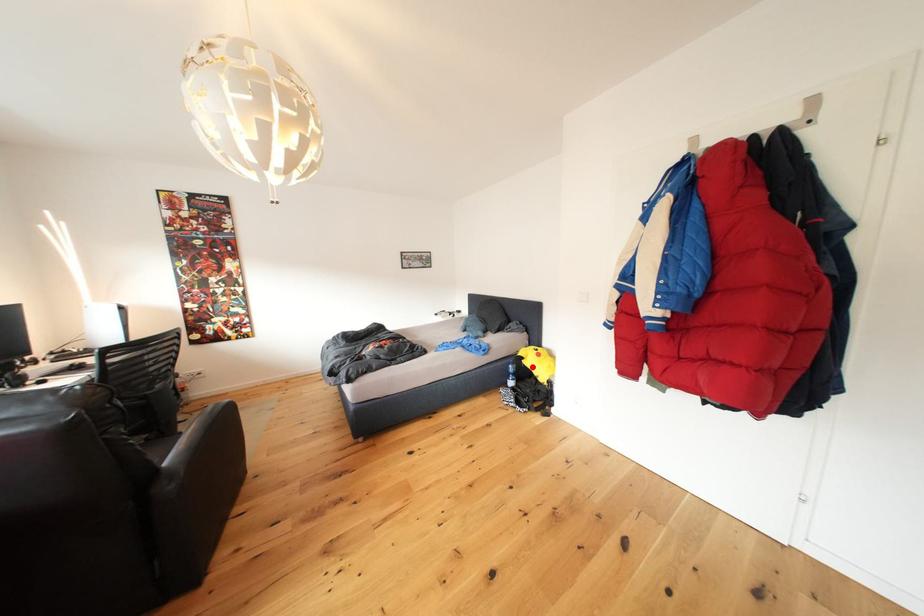
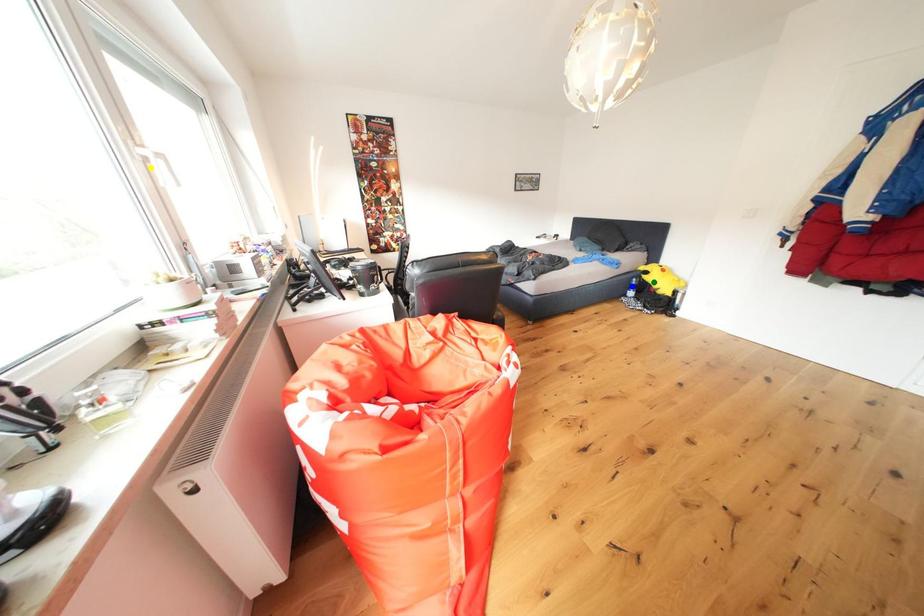
Question: I am providing you with two images of the same scene from different viewpoints. A red point is marked on the first image. You are given multiple points on the second image. Which point in image 2 is actually the same real-world point as the red point in image 1?

Choices:
 (A) yellow point
 (B) green point
 (C) blue point

Answer: (B)